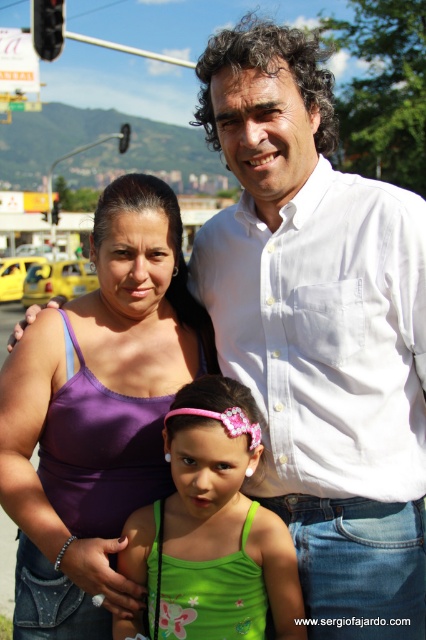
Question: Can you confirm if purple fabric tank top at center is positioned above green fabric dress at center?

Choices:
 (A) no
 (B) yes

Answer: (B)

Question: Is purple fabric tank top at center bigger than green fabric dress at center?

Choices:
 (A) no
 (B) yes

Answer: (B)

Question: Which point is closer to the camera?

Choices:
 (A) purple fabric tank top at center
 (B) green fabric dress at center

Answer: (B)

Question: Which point appears farthest from the camera in this image?

Choices:
 (A) (149, 563)
 (B) (106, 266)

Answer: (B)

Question: Is purple fabric tank top at center in front of green fabric dress at center?

Choices:
 (A) yes
 (B) no

Answer: (B)